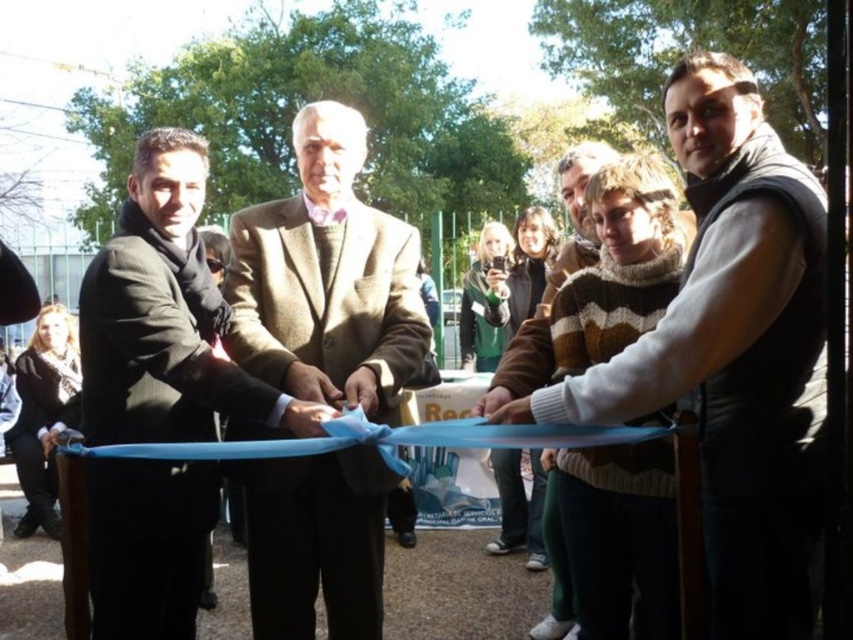
Question: Can you confirm if velvet brown vest at right is wider than brown woolen coat at center?

Choices:
 (A) no
 (B) yes

Answer: (B)

Question: Is velvet brown vest at right positioned behind brown woolen coat at center?

Choices:
 (A) no
 (B) yes

Answer: (A)

Question: Which point is farther to the camera?

Choices:
 (A) velvet brown vest at right
 (B) brown woolen coat at center
 (C) matte black suit at center

Answer: (B)

Question: Which object is the closest to the matte black suit at center?

Choices:
 (A) brown woolen coat at center
 (B) velvet brown vest at right

Answer: (A)

Question: Among these points, which one is nearest to the camera?

Choices:
 (A) pos(589,410)
 (B) pos(265,320)
 (C) pos(86,268)

Answer: (A)

Question: Can you confirm if brown woolen coat at center is positioned below matte black suit at center?

Choices:
 (A) yes
 (B) no

Answer: (B)